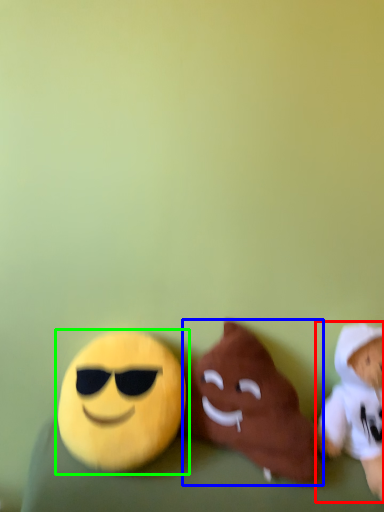
Question: Estimate the real-world distances between objects in this image. Which object is closer to toy (highlighted by a red box), toy (highlighted by a blue box) or toy (highlighted by a green box)?

Choices:
 (A) toy
 (B) toy

Answer: (A)